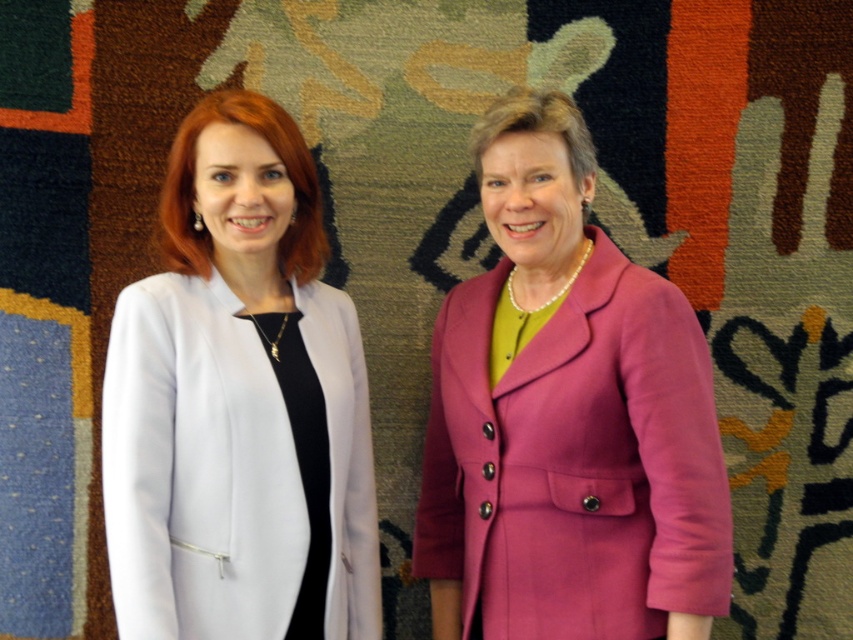
You are a fashion stylist preparing for a photoshoot. You have two coats available for styling. The purple woolen coat at center and the white smooth coat at left. The client wants to know which coat is placed above the other. Can you determine this based on the scene?

The purple woolen coat at center is positioned over the white smooth coat at left, so the purple woolen coat is above the white smooth coat.

You are a photographer setting up a shoot in this scene. You need to place a small prop exactly at the coordinates where the purple woolen coat at center is located. What coordinates should you use?

The purple woolen coat at center is located at point coordinates of [575,461] so you should place the prop at those coordinates.

You are a fashion designer who needs to decide which coat to display in the store window. The purple woolen coat at center and the white smooth coat at left are options. Based on their sizes, which coat would you choose to place on the lower shelf to save space?

The white smooth coat at left is shorter than the purple woolen coat at center, so it would be better to place the white smooth coat at left on the lower shelf to save space.